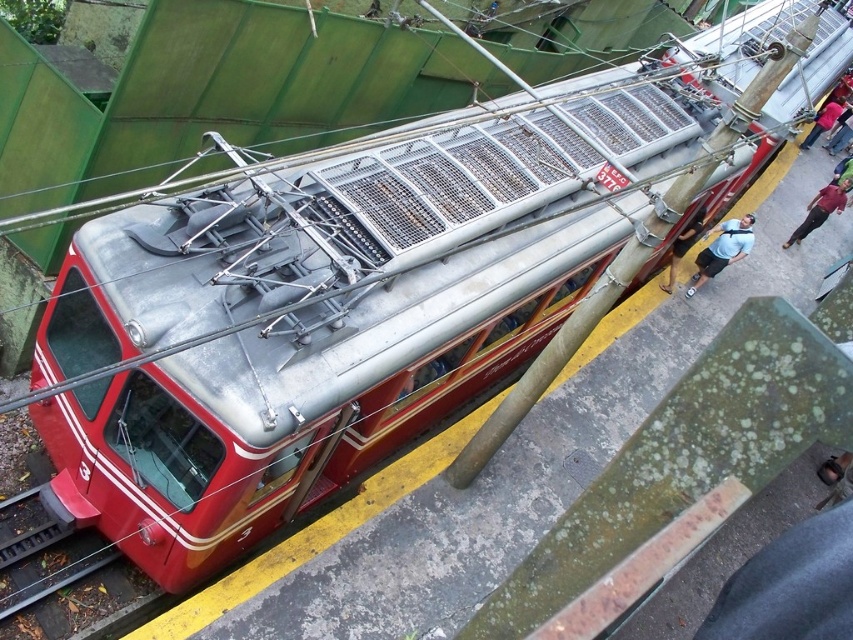
Consider the image. You are a passenger on the tram and want to put your light blue shirt at center and denim jacket at upper right into a luggage compartment located below the seats. Which item should you place first into the compartment?

The light blue shirt at center should be placed first into the luggage compartment because it is positioned under the denim jacket at upper right, meaning it is closer to the compartment.